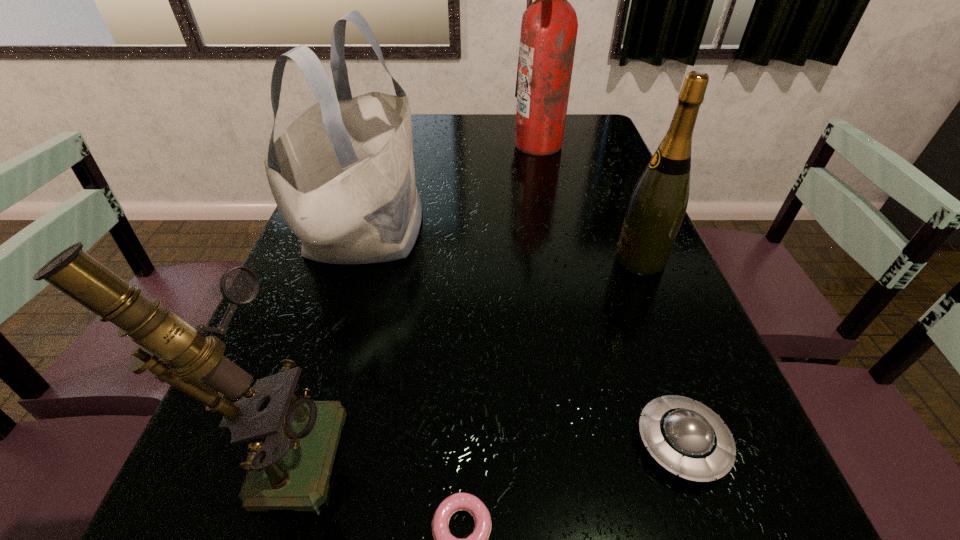
This screenshot has width=960, height=540. Find the location of `vacant space situated 0.140m on the front-facing side of the wine bottle`. vacant space situated 0.140m on the front-facing side of the wine bottle is located at coordinates (554, 260).

Find the location of `vacant space situated on the front-facing side of the wine bottle`. vacant space situated on the front-facing side of the wine bottle is located at coordinates (554, 260).

Locate an element on the screen. Image resolution: width=960 pixels, height=540 pixels. free region located 0.380m on the front-facing side of the wine bottle is located at coordinates (449, 260).

Find the location of `vacant position located 0.290m at the eyepiece of the microscope`. vacant position located 0.290m at the eyepiece of the microscope is located at coordinates (525, 443).

At what (x,y) coordinates should I click in order to perform the action: click on vacant space located on the left of the saucer. Please return your answer as a coordinate pair (x, y). The width and height of the screenshot is (960, 540). Looking at the image, I should click on (592, 443).

You are a GUI agent. You are given a task and a screenshot of the screen. Output one action in this format:
    pyautogui.click(x=<x>, y=<y>)
    Task: Click on the object present at the far edge
    
    Given the screenshot: What is the action you would take?
    pyautogui.click(x=549, y=26)

Image resolution: width=960 pixels, height=540 pixels. What are the coordinates of `shopping bag present at the left edge` in the screenshot? It's located at (342, 174).

Locate an element on the screen. microscope at the left edge is located at coordinates (294, 440).

This screenshot has width=960, height=540. Find the location of `wine bottle located at the right edge`. wine bottle located at the right edge is located at coordinates (658, 203).

Locate an element on the screen. saucer at the right edge is located at coordinates (687, 438).